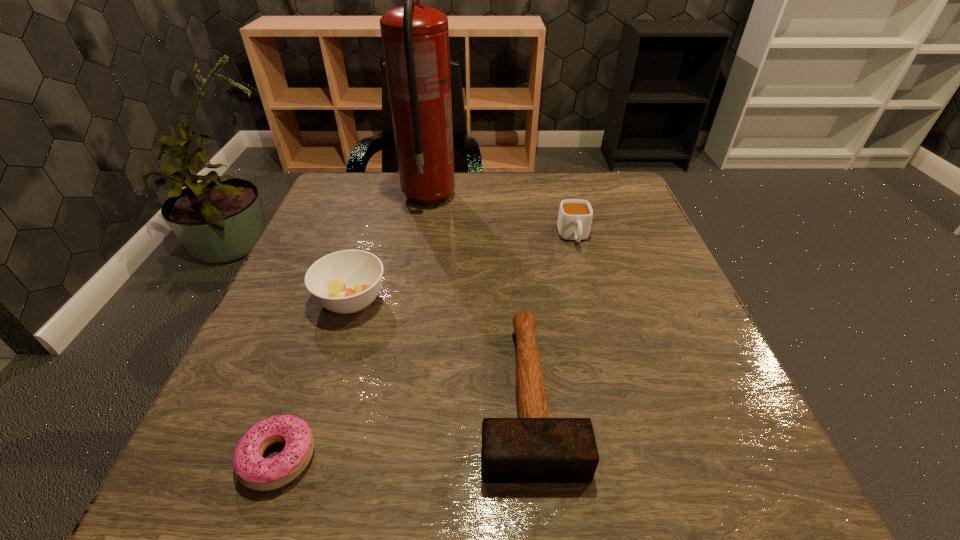
Where is `blank area at the right edge`? blank area at the right edge is located at coordinates (699, 389).

This screenshot has height=540, width=960. I want to click on vacant space at the far left corner of the desktop, so click(x=352, y=177).

Where is `vacant space at the near left corner`? The height and width of the screenshot is (540, 960). vacant space at the near left corner is located at coordinates (204, 483).

Locate an element on the screen. The width and height of the screenshot is (960, 540). vacant space at the far right corner of the desktop is located at coordinates (577, 184).

The height and width of the screenshot is (540, 960). In the image, there is a desktop. In order to click on vacant space at the near right corner in this screenshot , I will do `click(676, 494)`.

This screenshot has width=960, height=540. What are the coordinates of `vacant area between the doughnut and the mallet` in the screenshot? It's located at (403, 426).

Identify the location of blank region between the fire extinguisher and the cup. (501, 217).

Identify the location of free space between the shortest object and the fire extinguisher. (353, 327).

Locate an element on the screen. The image size is (960, 540). free space between the cup and the fire extinguisher is located at coordinates (501, 217).

Identify the location of free space that is in between the mallet and the third farthest object. This screenshot has height=540, width=960. (440, 347).